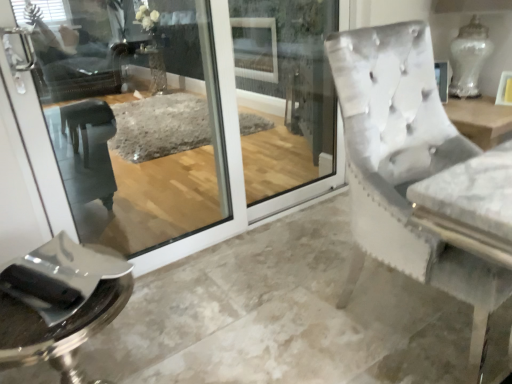
Question: Is clear glass screen door at center directly adjacent to polished chrome tray at lower left?

Choices:
 (A) no
 (B) yes

Answer: (A)

Question: Can you confirm if clear glass screen door at center is positioned to the left of polished chrome tray at lower left?

Choices:
 (A) no
 (B) yes

Answer: (A)

Question: From the image's perspective, is clear glass screen door at center located beneath polished chrome tray at lower left?

Choices:
 (A) no
 (B) yes

Answer: (A)

Question: Is clear glass screen door at center oriented towards polished chrome tray at lower left?

Choices:
 (A) no
 (B) yes

Answer: (B)

Question: Can you confirm if clear glass screen door at center is bigger than polished chrome tray at lower left?

Choices:
 (A) no
 (B) yes

Answer: (B)

Question: Can you confirm if clear glass screen door at center is wider than polished chrome tray at lower left?

Choices:
 (A) no
 (B) yes

Answer: (A)

Question: Is polished chrome tray at lower left next to clear glass screen door at center?

Choices:
 (A) yes
 (B) no

Answer: (B)

Question: From the image's perspective, would you say polished chrome tray at lower left is positioned over clear glass screen door at center?

Choices:
 (A) no
 (B) yes

Answer: (A)

Question: Is polished chrome tray at lower left positioned in front of clear glass screen door at center?

Choices:
 (A) yes
 (B) no

Answer: (A)

Question: From a real-world perspective, is polished chrome tray at lower left under clear glass screen door at center?

Choices:
 (A) yes
 (B) no

Answer: (A)

Question: Can you confirm if polished chrome tray at lower left is positioned to the left of clear glass screen door at center?

Choices:
 (A) yes
 (B) no

Answer: (A)

Question: Can you confirm if polished chrome tray at lower left is bigger than clear glass screen door at center?

Choices:
 (A) yes
 (B) no

Answer: (B)

Question: Considering the positions of clear glass screen door at center and polished chrome tray at lower left in the image, is clear glass screen door at center wider or thinner than polished chrome tray at lower left?

Choices:
 (A) thin
 (B) wide

Answer: (A)